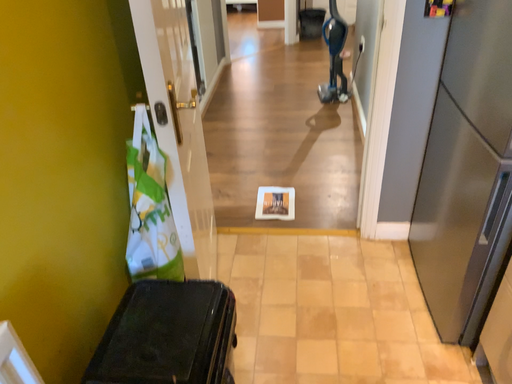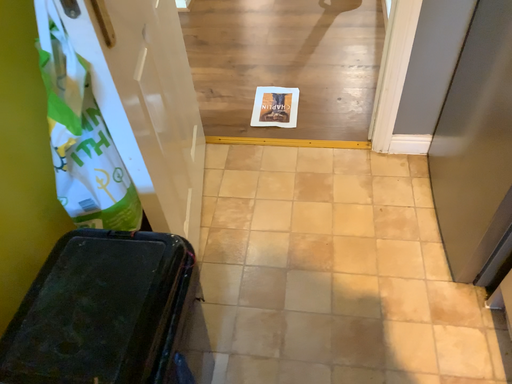
Question: Which way did the camera rotate in the video?

Choices:
 (A) rotated upward
 (B) rotated downward

Answer: (B)